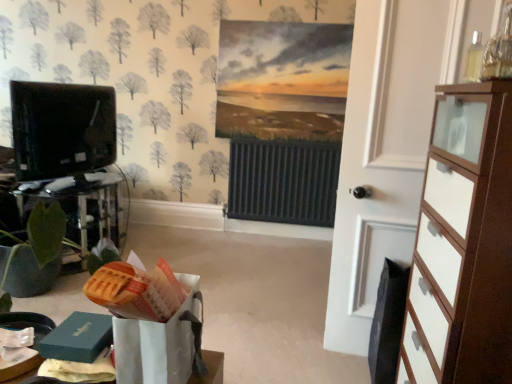
Question: Is white wood door at right not close to white glossy chest of drawers at right?

Choices:
 (A) no
 (B) yes

Answer: (A)

Question: Is white wood door at right to the left of white glossy chest of drawers at right from the viewer's perspective?

Choices:
 (A) no
 (B) yes

Answer: (B)

Question: From the image's perspective, is white wood door at right located above white glossy chest of drawers at right?

Choices:
 (A) yes
 (B) no

Answer: (A)

Question: From a real-world perspective, is white wood door at right physically below white glossy chest of drawers at right?

Choices:
 (A) yes
 (B) no

Answer: (B)

Question: From a real-world perspective, is white wood door at right located higher than white glossy chest of drawers at right?

Choices:
 (A) yes
 (B) no

Answer: (A)

Question: Is black glossy tv at left taller or shorter than white wood door at right?

Choices:
 (A) tall
 (B) short

Answer: (B)

Question: In terms of width, does black glossy tv at left look wider or thinner when compared to white wood door at right?

Choices:
 (A) wide
 (B) thin

Answer: (A)

Question: From the image's perspective, is black glossy tv at left above or below white wood door at right?

Choices:
 (A) above
 (B) below

Answer: (A)

Question: Is black glossy tv at left inside or outside of white wood door at right?

Choices:
 (A) inside
 (B) outside

Answer: (B)

Question: From the image's perspective, is white wood door at right positioned above or below white glossy chest of drawers at right?

Choices:
 (A) above
 (B) below

Answer: (A)

Question: In terms of height, does white wood door at right look taller or shorter compared to white glossy chest of drawers at right?

Choices:
 (A) short
 (B) tall

Answer: (B)

Question: Is white wood door at right inside the boundaries of white glossy chest of drawers at right, or outside?

Choices:
 (A) inside
 (B) outside

Answer: (B)

Question: Would you say white wood door at right is to the left or to the right of white glossy chest of drawers at right in the picture?

Choices:
 (A) left
 (B) right

Answer: (A)

Question: Looking at their shapes, would you say white wood door at right is wider or thinner than black glossy tv at left?

Choices:
 (A) thin
 (B) wide

Answer: (A)

Question: Relative to black glossy tv at left, is white wood door at right in front or behind?

Choices:
 (A) front
 (B) behind

Answer: (A)